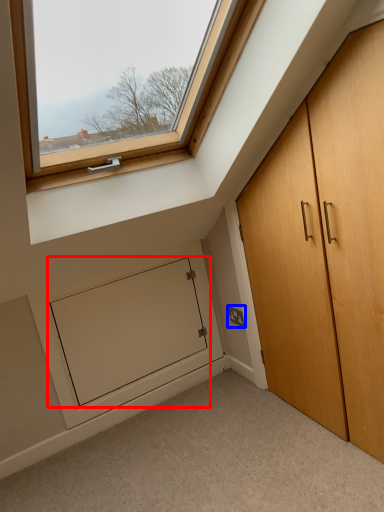
Question: Which of the following is the closest to the observer, screen door (highlighted by a red box) or electric outlet (highlighted by a blue box)?

Choices:
 (A) screen door
 (B) electric outlet

Answer: (A)